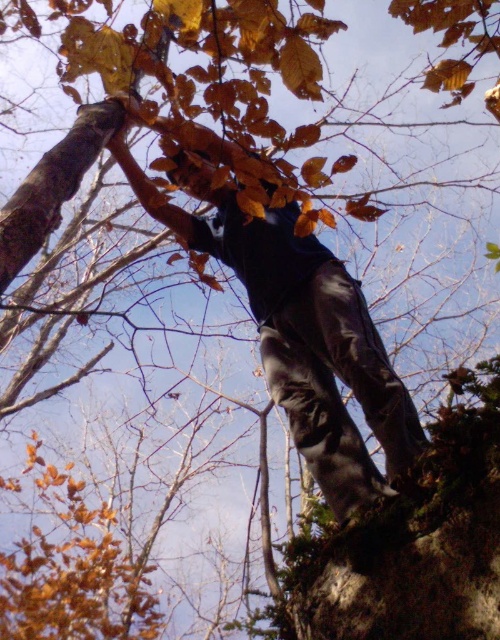
Consider the image. Does black matte pants at center have a lesser width compared to dark gray rock at lower right?

No.

Is black matte pants at center positioned before dark gray rock at lower right?

No, black matte pants at center is further to the viewer.

Is point (395, 429) less distant than point (498, 417)?

No.

Image resolution: width=500 pixels, height=640 pixels. I want to click on black matte pants at center, so click(302, 333).